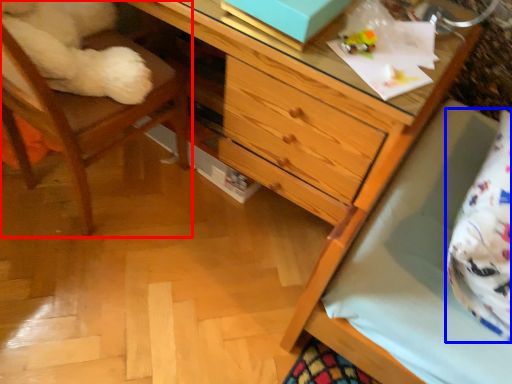
Question: Which object appears farthest to the camera in this image, chair (highlighted by a red box) or pillow (highlighted by a blue box)?

Choices:
 (A) chair
 (B) pillow

Answer: (B)